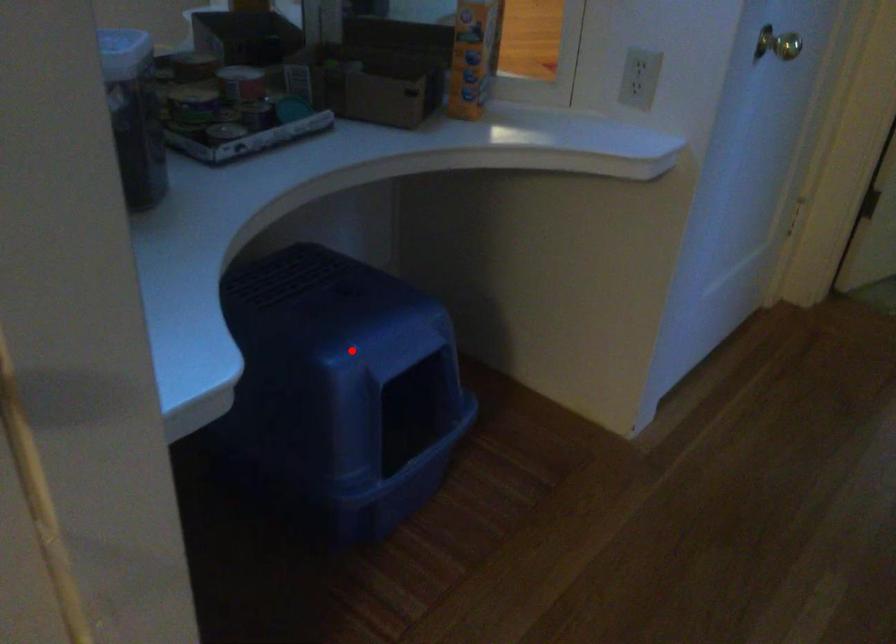
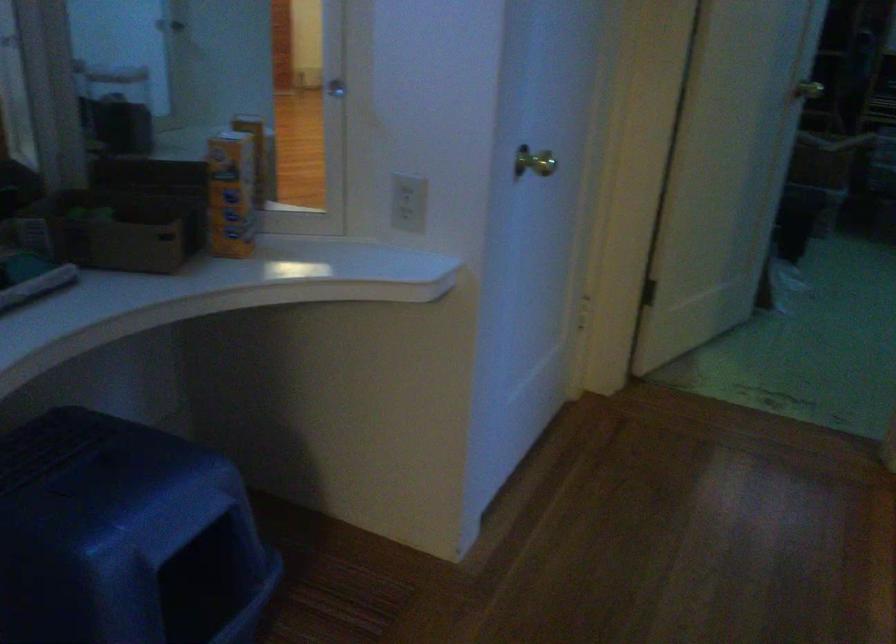
Question: I am providing you with two images of the same scene from different viewpoints. A red point is marked on the first image. Can you still see the location of the red point in image 2?

Choices:
 (A) Yes
 (B) No

Answer: (A)